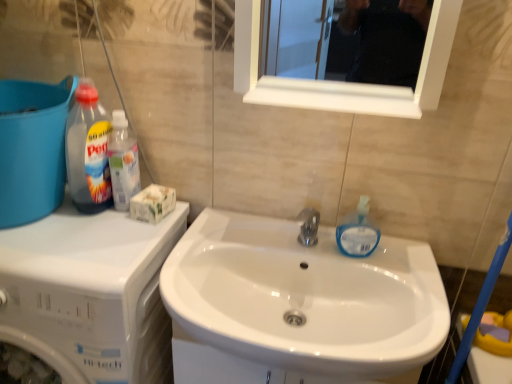
This screenshot has width=512, height=384. What are the coordinates of `vacant space situated above white glossy dishwasher at left (from a real-world perspective)` in the screenshot? It's located at (60, 235).